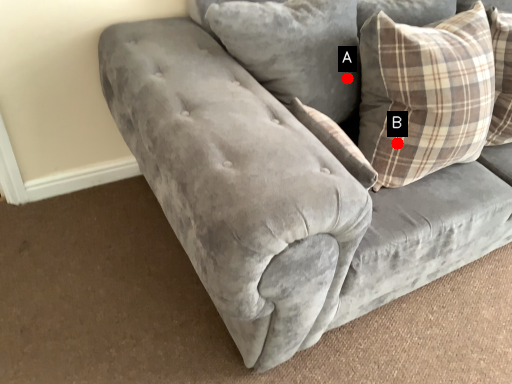
Question: Two points are circled on the image, labeled by A and B beside each circle. Which of the following is the farthest from the observer?

Choices:
 (A) A is further
 (B) B is further

Answer: (A)